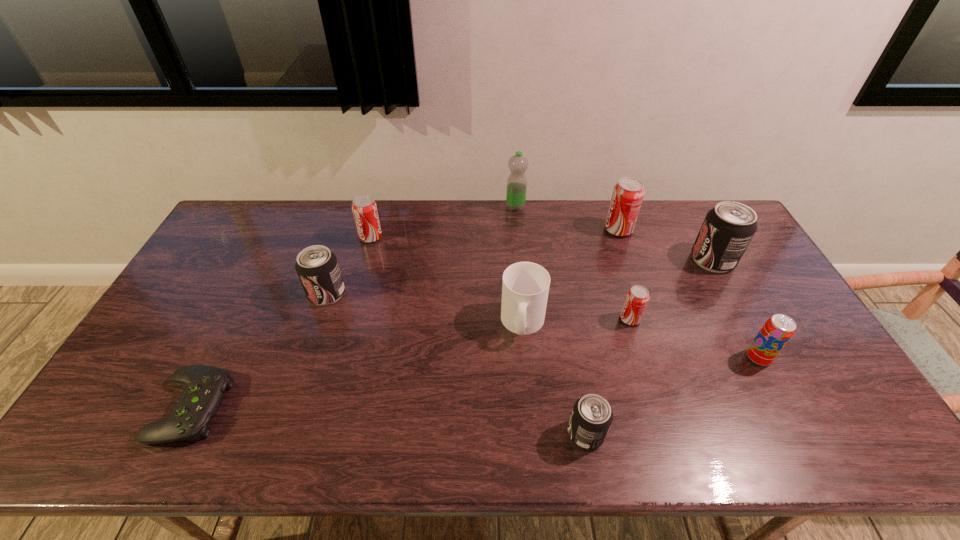
Where is `vacant area that lies between the leftmost red soda can and the mug`? The height and width of the screenshot is (540, 960). vacant area that lies between the leftmost red soda can and the mug is located at coordinates (446, 280).

At what (x,y) coordinates should I click in order to perform the action: click on free space between the fourth farthest soda can and the biggest red soda can. Please return your answer as a coordinate pair (x, y). Looking at the image, I should click on (472, 261).

Locate an element on the screen. empty space between the leftmost object and the green water bottle is located at coordinates (353, 308).

I want to click on empty space between the leftmost red soda can and the fifth nearest soda can, so click(x=541, y=248).

Where is `vacant point located between the farthest object and the nearest soda can`? This screenshot has width=960, height=540. vacant point located between the farthest object and the nearest soda can is located at coordinates (551, 320).

You are a GUI agent. You are given a task and a screenshot of the screen. Output one action in this format:
    pyautogui.click(x=<x>, y=<y>)
    Task: Click on the vacant point located between the leftmost red soda can and the white mug
    The width and height of the screenshot is (960, 540).
    Given the screenshot: What is the action you would take?
    pyautogui.click(x=446, y=280)

Locate an element on the screen. This screenshot has height=540, width=960. vacant area that lies between the fourth nearest soda can and the biggest red soda can is located at coordinates (472, 261).

Where is `free space that is in between the control and the biggest red soda can`? free space that is in between the control and the biggest red soda can is located at coordinates click(x=405, y=319).

At what (x,y) coordinates should I click in order to perform the action: click on unoccupied position between the rightmost black soda can and the white mug. Please return your answer as a coordinate pair (x, y). The width and height of the screenshot is (960, 540). Looking at the image, I should click on (618, 292).

Find the location of `the fifth closest object to the white mug`. the fifth closest object to the white mug is located at coordinates (317, 267).